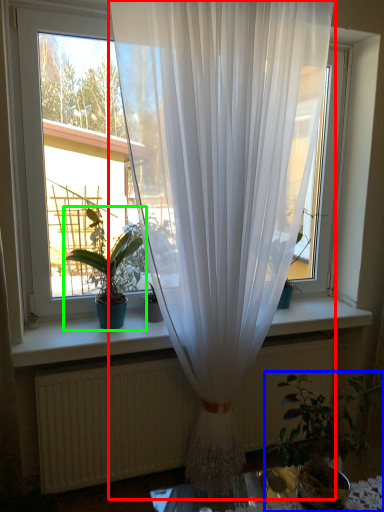
Question: Considering the real-world distances, which object is closest to curtain (highlighted by a red box)? houseplant (highlighted by a blue box) or houseplant (highlighted by a green box).

Choices:
 (A) houseplant
 (B) houseplant

Answer: (B)